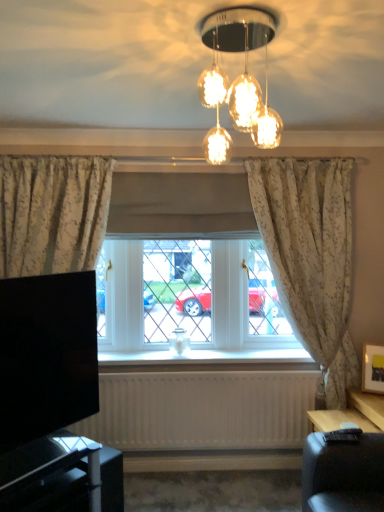
Locate an element on the screen. blank space situated above white textured radiator at lower center (from a real-world perspective) is located at coordinates (192, 370).